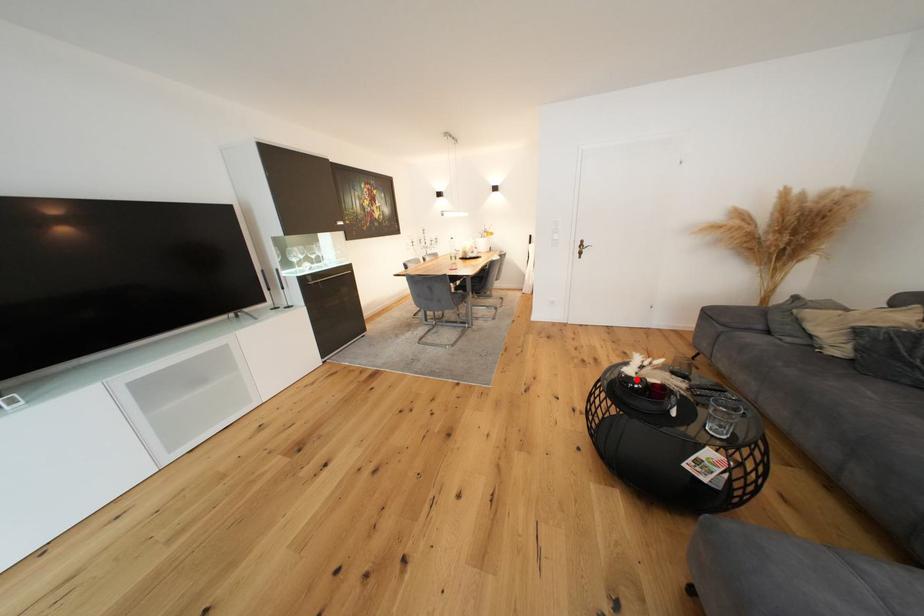
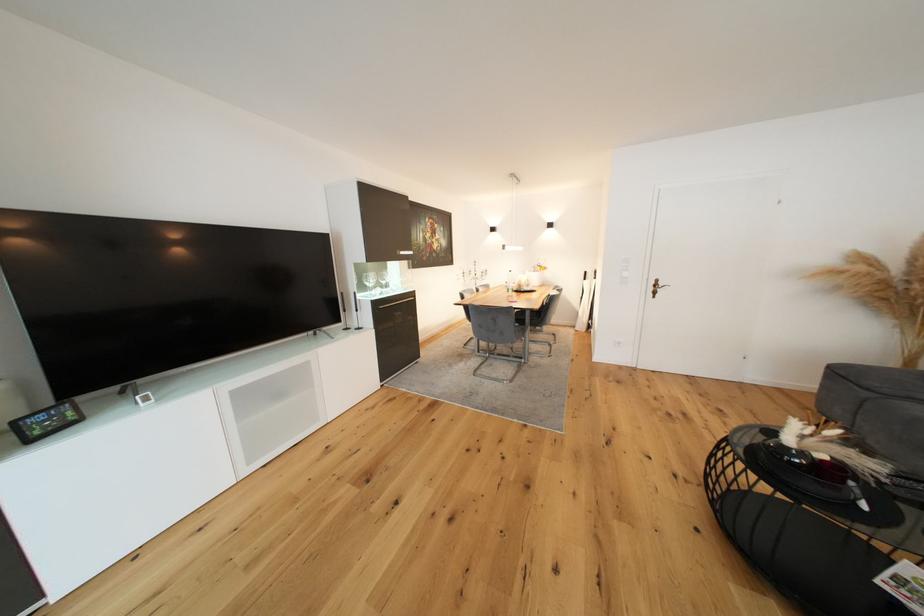
Question: I am providing you with two images of the same scene from different viewpoints. In image1, a red point is highlighted. Considering the same 3D point in image2, which of the following is correct?

Choices:
 (A) It is closer
 (B) It is farther

Answer: (B)